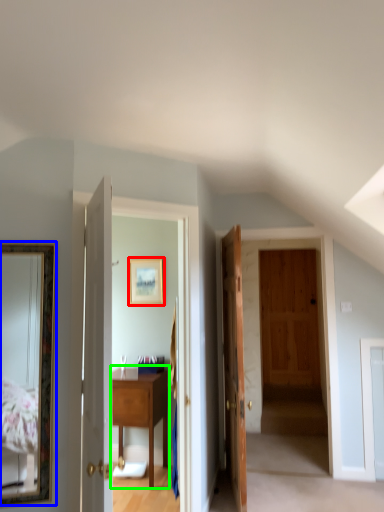
Question: Considering the real-world distances, which object is farthest from picture frame (highlighted by a red box)? mirror (highlighted by a blue box) or table (highlighted by a green box)?

Choices:
 (A) mirror
 (B) table

Answer: (A)